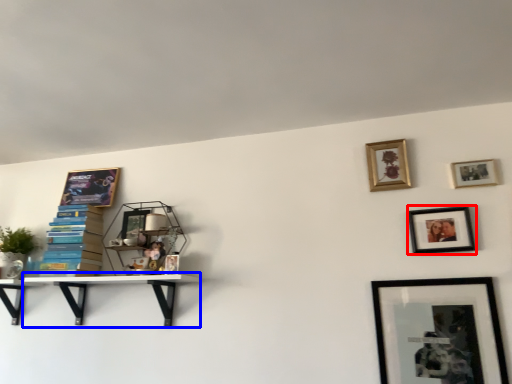
Question: Which point is further to the camera, picture frame (highlighted by a red box) or shelf (highlighted by a blue box)?

Choices:
 (A) picture frame
 (B) shelf

Answer: (B)